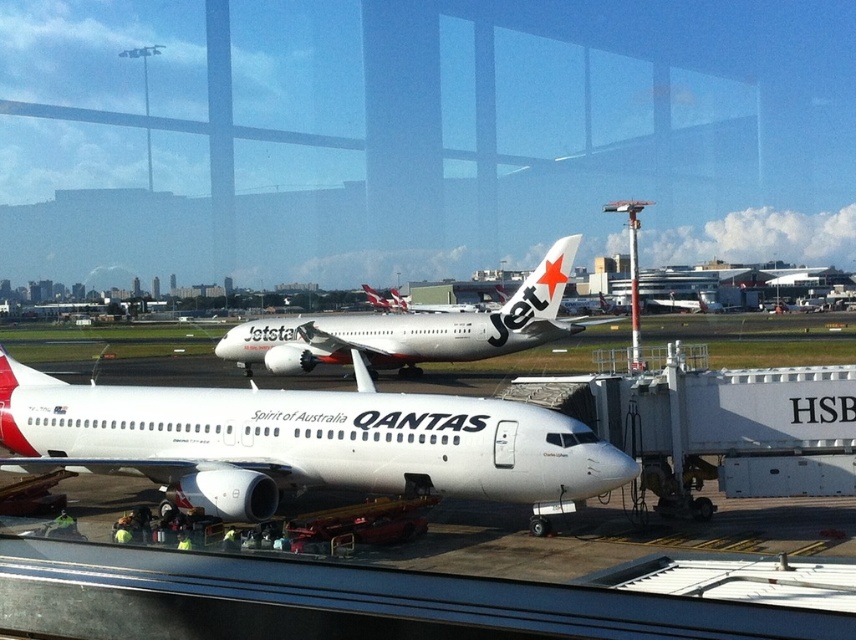
You are a pilot standing at the jet bridge labeled HSB. You need to board the white glossy airliner at center, but there is a white glossy airplane at center blocking the path. Can you safely walk around the airplane to reach the airliner?

The white glossy airliner at center is 58.70 feet away from the white glossy airplane at center. Since the distance between them is sufficient, you can safely walk around the airplane to reach the airliner.

You are standing at the airport window and want to locate the white glossy airliner at center. According to the coordinates provided, where exactly is it positioned in the image?

The white glossy airliner at center is positioned at coordinates point (301, 442).

You are an airport security officer checking the layout of the airport. You notice two aircraft in the scene, the white glossy airliner at center and the white glossy airplane at center. Which one is smaller in size?

The white glossy airliner at center is smaller than the white glossy airplane at center according to the description.